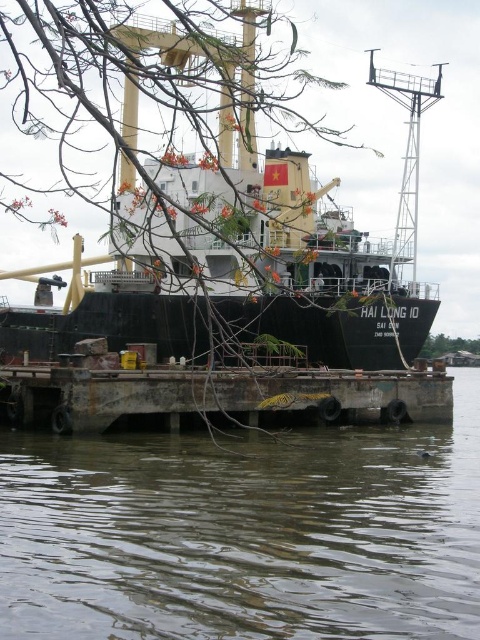
You are standing on the pier and want to reach the point marked at coordinates (407, 525). Given that the pier is 200 feet long, can you safely walk to that point without exceeding the pier length?

The point at coordinates (407, 525) is 213.22 feet from the camera, which exceeds the pier length of 200 feet. Therefore, you cannot safely walk to that point without going beyond the pier.

You are a port authority inspector tasked with ensuring safe docking procedures. You observe the black matte ship at center and the rusty metal dock at lower center. Based on their sizes, which one poses a greater challenge for securing during strong winds?

The black matte ship at center is larger in size than the rusty metal dock at lower center, so it poses a greater challenge for securing during strong winds because its larger size may require more robust anchoring and stabilization measures.

You are standing on the pier and want to board the black matte ship at center. If your walking speed is 1.5 meters per second, how many seconds will it take you to reach the ship?

The black matte ship at center is 57.44 meters away from the viewer. At a walking speed of 1.5 meters per second, it would take approximately 38.29 seconds to reach the ship.